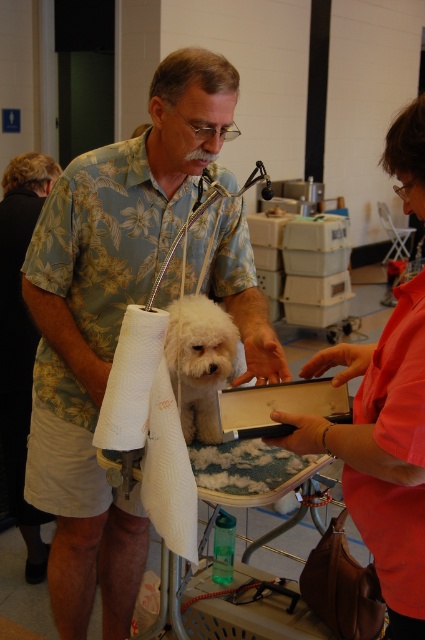
Question: Can you confirm if matte pink shirt at center is thinner than white paper towel at left?

Choices:
 (A) no
 (B) yes

Answer: (A)

Question: Among these points, which one is farthest from the camera?

Choices:
 (A) (37, 188)
 (B) (99, 225)

Answer: (A)

Question: Is matte pink shirt at center below white fluffy dog at center?

Choices:
 (A) yes
 (B) no

Answer: (B)

Question: Among these objects, which one is farthest from the camera?

Choices:
 (A) white paper towel at center
 (B) white paper towel at left
 (C) white fluffy dog at center

Answer: (C)

Question: Estimate the real-world distances between objects in this image. Which object is closer to the matte pink shirt at center?

Choices:
 (A) white paper towel at center
 (B) black fabric hair at upper left
 (C) white paper towel at left
 (D) floral shirt at center

Answer: (A)

Question: Can you confirm if floral shirt at center is positioned above white fluffy dog at center?

Choices:
 (A) no
 (B) yes

Answer: (A)